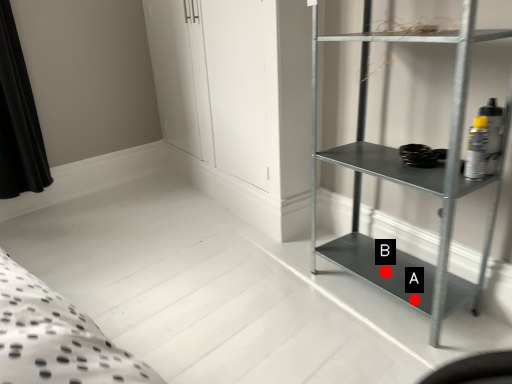
Question: Two points are circled on the image, labeled by A and B beside each circle. Which point is closer to the camera?

Choices:
 (A) A is closer
 (B) B is closer

Answer: (A)